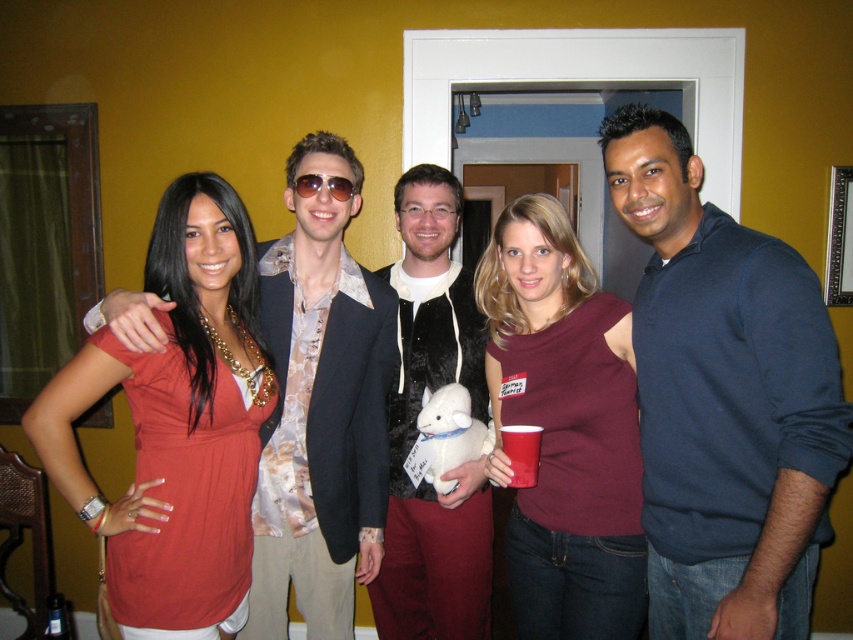
Question: Does maroon sleeveless top at center have a lesser width compared to fuzzy black vest at center?

Choices:
 (A) no
 (B) yes

Answer: (A)

Question: Which point is closer to the camera?

Choices:
 (A) maroon sleeveless top at center
 (B) matte orange blouse at center
 (C) dark blue sweater at center

Answer: (C)

Question: Which object is closer to the camera taking this photo?

Choices:
 (A) maroon sleeveless top at center
 (B) sunglasses at center
 (C) matte orange blouse at center

Answer: (C)

Question: Is matte orange blouse at center above sunglasses at center?

Choices:
 (A) no
 (B) yes

Answer: (A)

Question: Considering the real-world distances, which object is farthest from the matte orange blouse at center?

Choices:
 (A) shiny metallic jacket at center
 (B) maroon sleeveless top at center
 (C) dark blue sweater at center
 (D) sunglasses at center

Answer: (C)

Question: Where is matte orange blouse at center located in relation to fuzzy black vest at center in the image?

Choices:
 (A) right
 (B) left

Answer: (B)